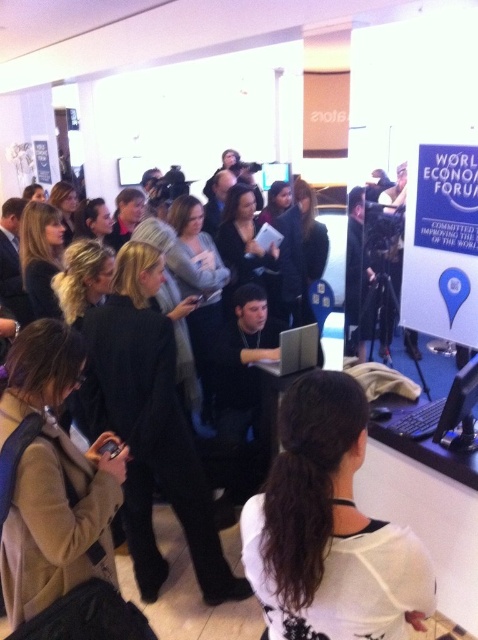
Question: Which object is closer to the camera taking this photo?

Choices:
 (A) white matte shirt at center
 (B) silver metallic laptop at center

Answer: (A)

Question: Can you confirm if white matte shirt at center is positioned to the right of silver metallic laptop at center?

Choices:
 (A) yes
 (B) no

Answer: (B)

Question: Is white matte shirt at center bigger than silver metallic laptop at center?

Choices:
 (A) yes
 (B) no

Answer: (A)

Question: Can you confirm if white matte shirt at center is thinner than silver metallic laptop at center?

Choices:
 (A) no
 (B) yes

Answer: (A)

Question: Which point is closer to the camera?

Choices:
 (A) white matte shirt at center
 (B) silver metallic laptop at center

Answer: (A)

Question: Among these objects, which one is nearest to the camera?

Choices:
 (A) silver metallic laptop at center
 (B) white matte shirt at center

Answer: (B)